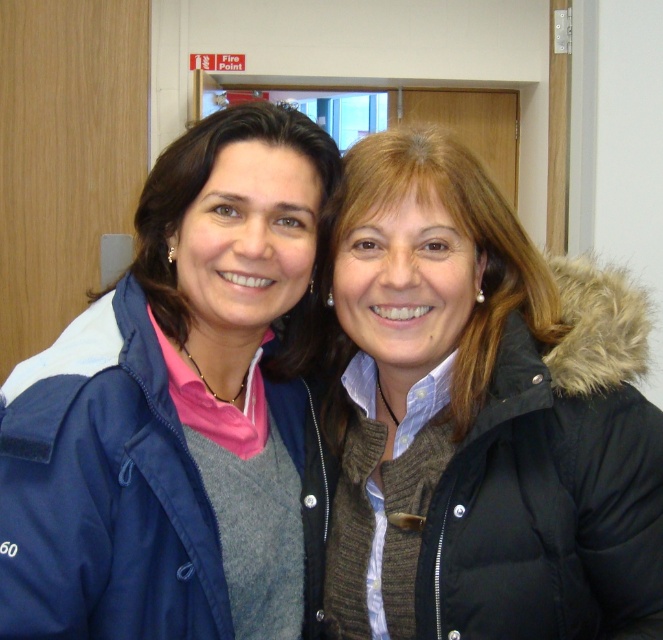
You are trying to decide which jacket to wear based on height. You need a jacket that reaches below your waist. Given the scene, which jacket between the black puffy jacket at right and the navy blue jacket at left would you choose?

The black puffy jacket at right has a greater height compared to the navy blue jacket at left, so you should choose the black puffy jacket at right since it reaches below the waist.

You are a tailor measuring jackets for alterations. You have a 30 cm wide tailor table. Which jacket, the black puffy jacket at right or the navy blue jacket at left, can you place on the table without needing to fold it?

The black puffy jacket at right has a greater width than the navy blue jacket at left. Since the tailor table is only 30 cm wide, the navy blue jacket at left is narrower and can fit without folding, while the black puffy jacket at right may not fit due to its wider size.

Based on the photo, you are a tailor measuring jackets for alterations. You need to determine if there is enough space between the two jackets to fit a 10 inch ruler between them. Can you fit the ruler between the black puffy jacket at right and the navy blue jacket at left?

The distance between the black puffy jacket at right and navy blue jacket at left is 12.52 inches, which is greater than the 10 inch ruler. Therefore, the ruler can fit between them.